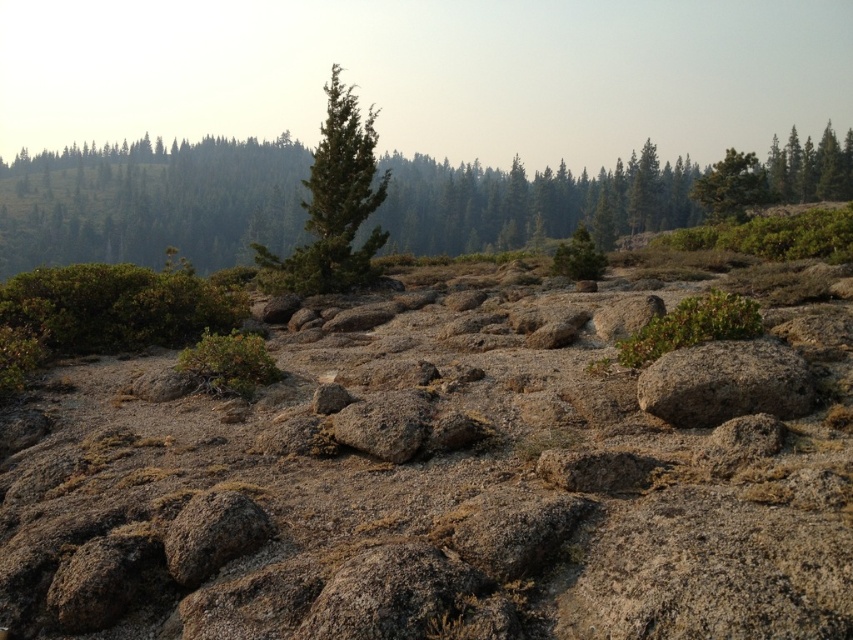
Question: Observing the image, what is the correct spatial positioning of gray rough rock at center in reference to green matte tree at center?

Choices:
 (A) left
 (B) right

Answer: (A)

Question: Is gray rough rock at center to the right of green matte tree at center from the viewer's perspective?

Choices:
 (A) yes
 (B) no

Answer: (B)

Question: Can you confirm if dull gray rock at center is wider than green textured tree at center?

Choices:
 (A) yes
 (B) no

Answer: (B)

Question: Based on their relative distances, which object is nearer to the gray rough rock at center?

Choices:
 (A) gray rough boulder at center-right
 (B) green matte tree at center
 (C) green textured pine trees at upper center
 (D) dull gray rock at center

Answer: (D)

Question: Which object appears closest to the camera in this image?

Choices:
 (A) dull gray rock at center
 (B) green matte tree at center
 (C) green textured pine trees at upper center
 (D) green textured tree at center

Answer: (A)

Question: Which object is farther from the camera taking this photo?

Choices:
 (A) green matte tree at center
 (B) green textured tree at center
 (C) dull gray rock at center
 (D) gray rough rock at center

Answer: (B)